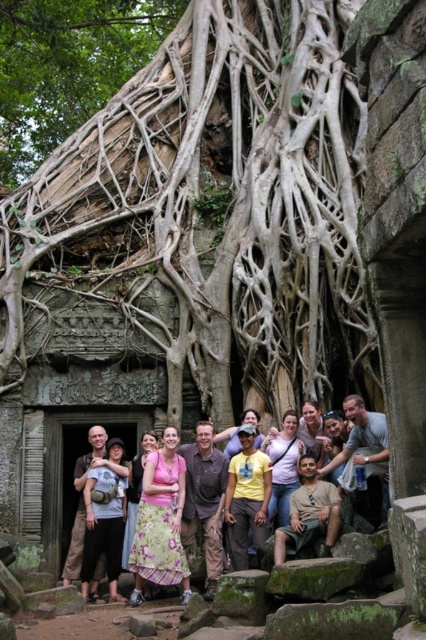
Which is behind, point (166, 560) or point (115, 445)?

Positioned behind is point (115, 445).

Where is `floral skirt at center`? floral skirt at center is located at coordinates (161, 522).

Identify the location of floral skirt at center. (161, 522).

Does white textured roots at center lie behind pink floral dress at center?

Yes, white textured roots at center is behind pink floral dress at center.

Does point (285, 195) come behind point (305, 452)?

Yes.

At what (x,y) coordinates should I click in order to perform the action: click on white textured roots at center. Please return your answer as a coordinate pair (x, y). The width and height of the screenshot is (426, 640). Looking at the image, I should click on (198, 209).

At what (x,y) coordinates should I click in order to perform the action: click on white textured roots at center. Please return your answer as a coordinate pair (x, y). This screenshot has height=640, width=426. Looking at the image, I should click on (198, 209).

Who is more forward, (181, 561) or (354, 397)?

Point (181, 561) is in front.

Is floral skirt at center positioned at the back of pink floral dress at center?

Yes, it is behind pink floral dress at center.

Measure the distance between point (x=160, y=561) and camera.

Point (x=160, y=561) is 60.57 meters away from camera.

The width and height of the screenshot is (426, 640). Identify the location of floral skirt at center. (161, 522).